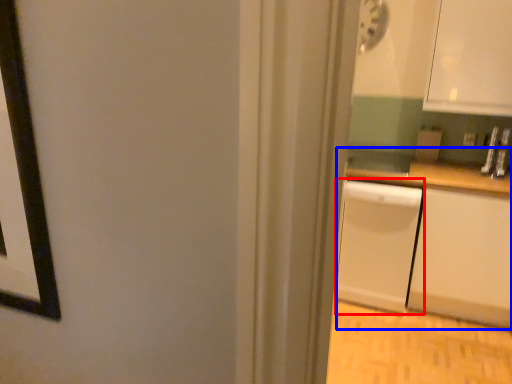
Question: Which object appears farthest to the camera in this image, dish washer (highlighted by a red box) or counter (highlighted by a blue box)?

Choices:
 (A) dish washer
 (B) counter

Answer: (A)